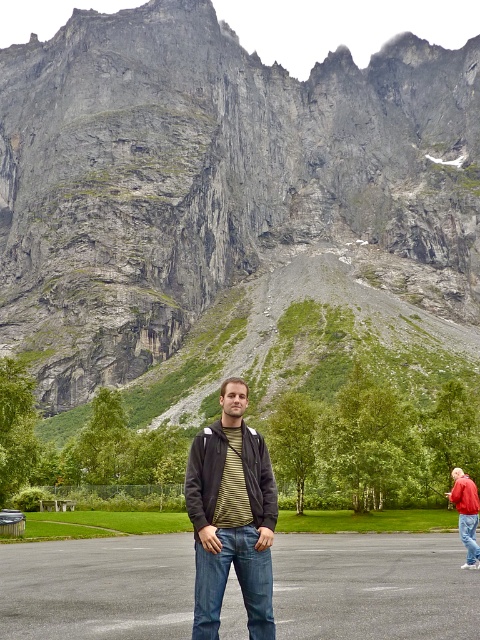
From the picture: Does blue denim jeans at center have a lesser height compared to striped knit sweater at center?

Correct, blue denim jeans at center is not as tall as striped knit sweater at center.

Is blue denim jeans at center above striped knit sweater at center?

Incorrect, blue denim jeans at center is not positioned above striped knit sweater at center.

Is point (16, 593) in front of point (213, 573)?

No, it is not.

Where is `blue denim jeans at center`? blue denim jeans at center is located at coordinates (373, 588).

What do you see at coordinates (218, 186) in the screenshot? I see `rugged granite mountain at upper center` at bounding box center [218, 186].

Identify the location of rugged granite mountain at upper center. The width and height of the screenshot is (480, 640). (218, 186).

Does striped knit sweater at center appear on the left side of red leather jacket at lower right?

Yes, striped knit sweater at center is to the left of red leather jacket at lower right.

Does striped knit sweater at center have a larger size compared to red leather jacket at lower right?

Correct, striped knit sweater at center is larger in size than red leather jacket at lower right.

Describe the element at coordinates (231, 516) in the screenshot. I see `striped knit sweater at center` at that location.

Locate an element on the screen. This screenshot has height=640, width=480. striped knit sweater at center is located at coordinates (231, 516).